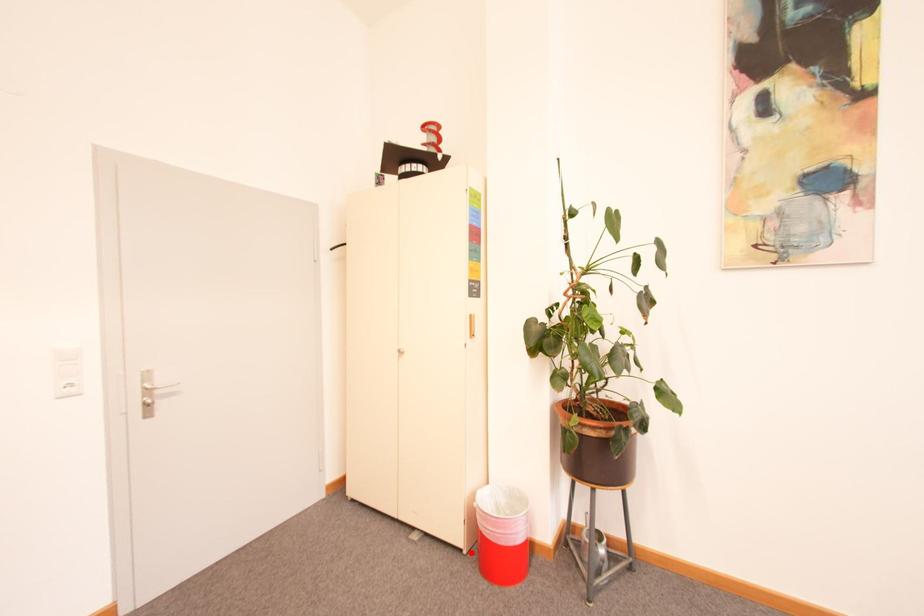
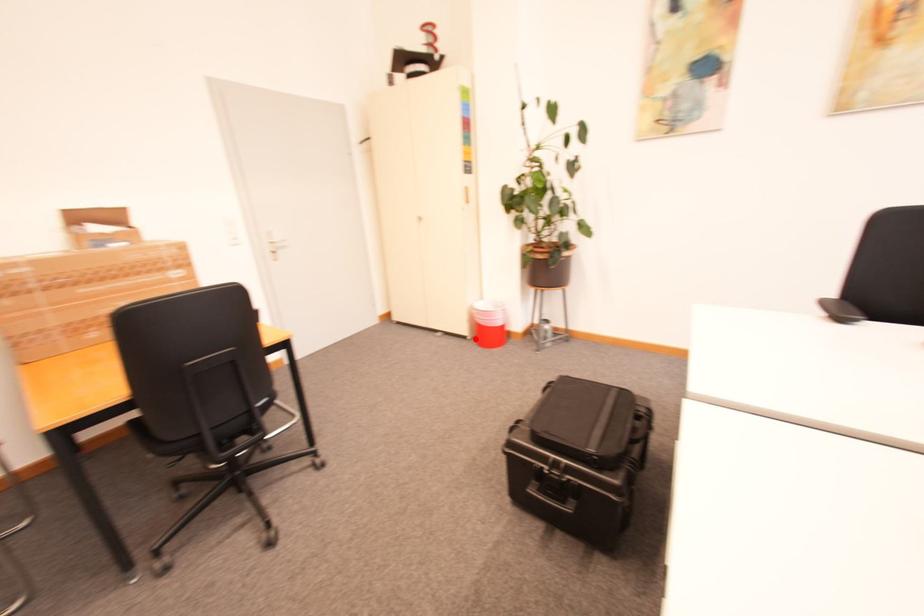
I am providing you with two images of the same scene from different viewpoints. A red point is marked on the first image and another point is marked on the second image. Does the point marked in image1 correspond to the same location as the one in image2?

Yes